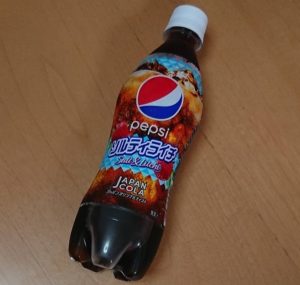
This screenshot has height=285, width=300. What are the coordinates of `teardrop shaped light blue light reflection` in the screenshot? It's located at (106, 249).